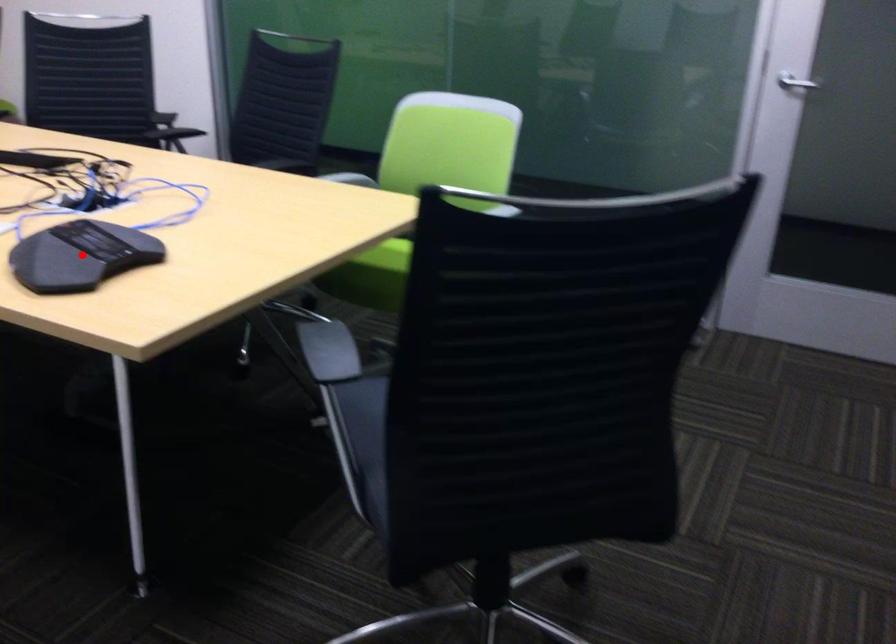
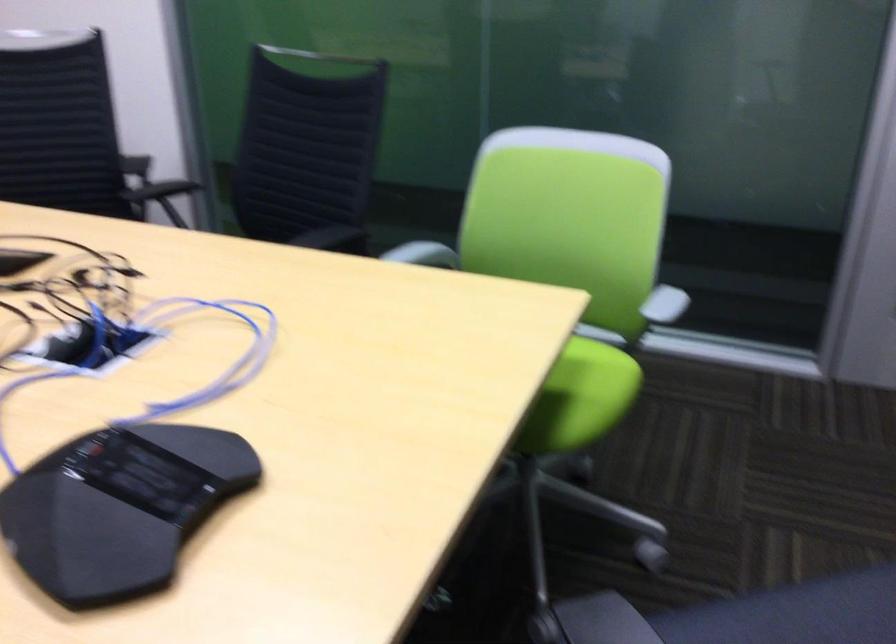
Question: I am providing you with two images of the same scene from different viewpoints. A red point is marked on the first image. Can you still see the location of the red point in image 2?

Choices:
 (A) Yes
 (B) No

Answer: (A)